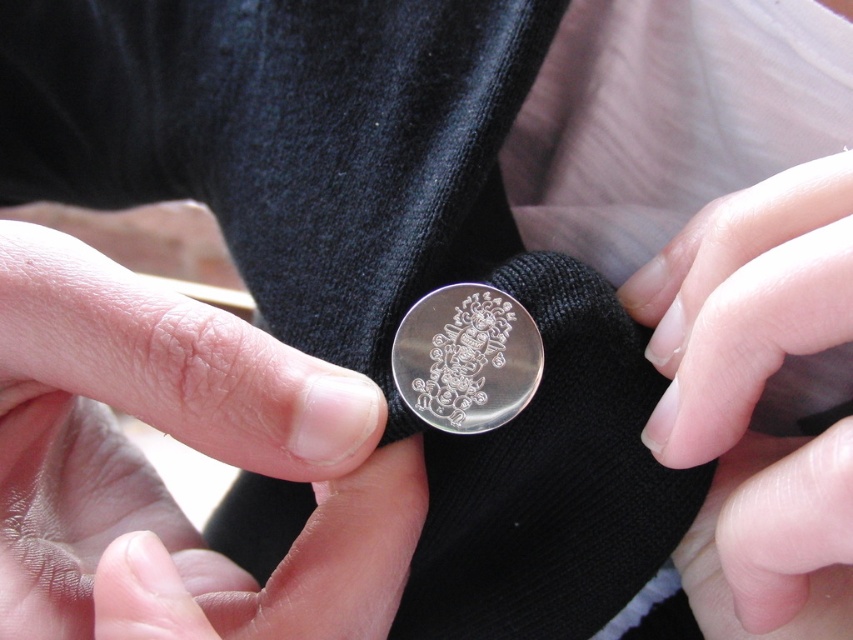
Does nail polish at center appear on the right side of silver polished coin at center?

Yes, nail polish at center is to the right of silver polished coin at center.

Can you confirm if nail polish at center is taller than silver polished coin at center?

Correct, nail polish at center is much taller as silver polished coin at center.

Locate an element on the screen. nail polish at center is located at coordinates pos(756,401).

Where is `nail polish at center`? nail polish at center is located at coordinates (756, 401).

Who is more distant from viewer, (157,476) or (405,376)?

Point (157,476)

Describe the element at coordinates (186, 444) in the screenshot. This screenshot has height=640, width=853. I see `smooth silver coin at center` at that location.

Where is `smooth silver coin at center`? Image resolution: width=853 pixels, height=640 pixels. smooth silver coin at center is located at coordinates (186, 444).

Who is shorter, smooth silver coin at center or nail polish at center?

smooth silver coin at center

Can you confirm if smooth silver coin at center is positioned to the left of nail polish at center?

Yes, smooth silver coin at center is to the left of nail polish at center.

Identify the location of smooth silver coin at center. point(186,444).